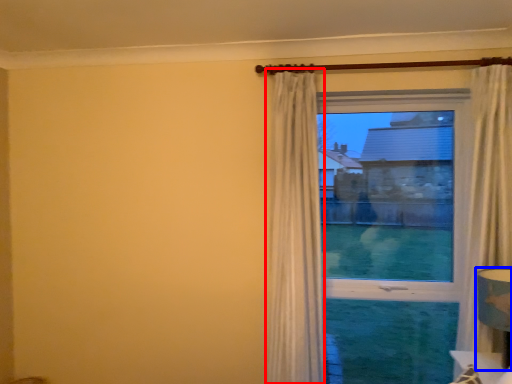
Question: Among these objects, which one is farthest to the camera, curtain (highlighted by a red box) or table lamp (highlighted by a blue box)?

Choices:
 (A) curtain
 (B) table lamp

Answer: (A)